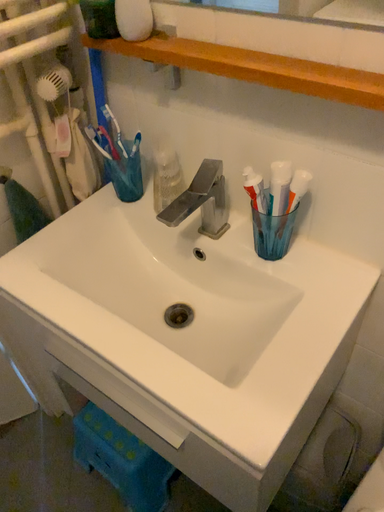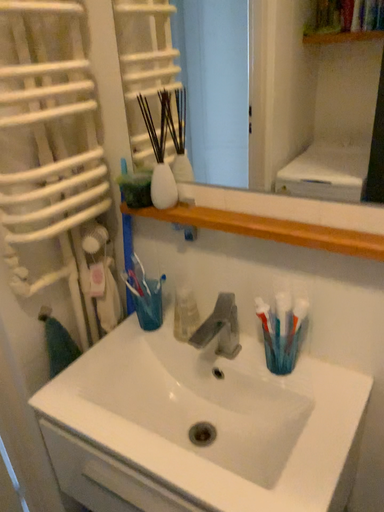
Question: How did the camera likely rotate when shooting the video?

Choices:
 (A) rotated upward
 (B) rotated downward

Answer: (A)